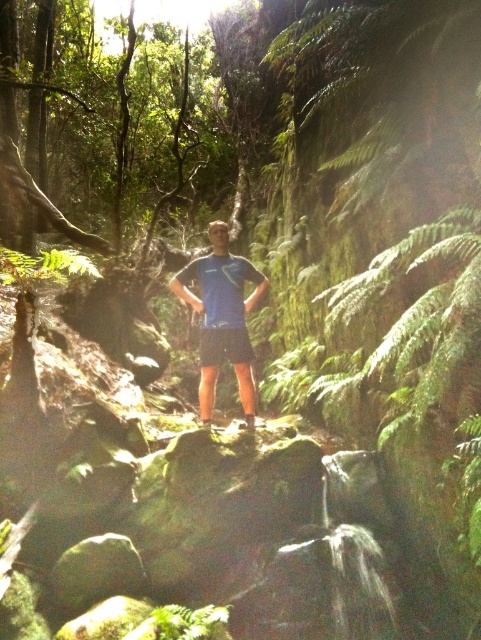
Is blue fabric shirt at center smaller than blue fabric shorts at center?

No, blue fabric shirt at center is not smaller than blue fabric shorts at center.

Does blue fabric shirt at center have a lesser height compared to blue fabric shorts at center?

Incorrect, blue fabric shirt at center's height does not fall short of blue fabric shorts at center's.

The height and width of the screenshot is (640, 481). What do you see at coordinates (222, 316) in the screenshot? I see `blue fabric shirt at center` at bounding box center [222, 316].

You are a GUI agent. You are given a task and a screenshot of the screen. Output one action in this format:
    pyautogui.click(x=<x>, y=<y>)
    Task: Click on the blue fabric shirt at center
    This screenshot has width=481, height=640.
    Given the screenshot: What is the action you would take?
    pyautogui.click(x=222, y=316)